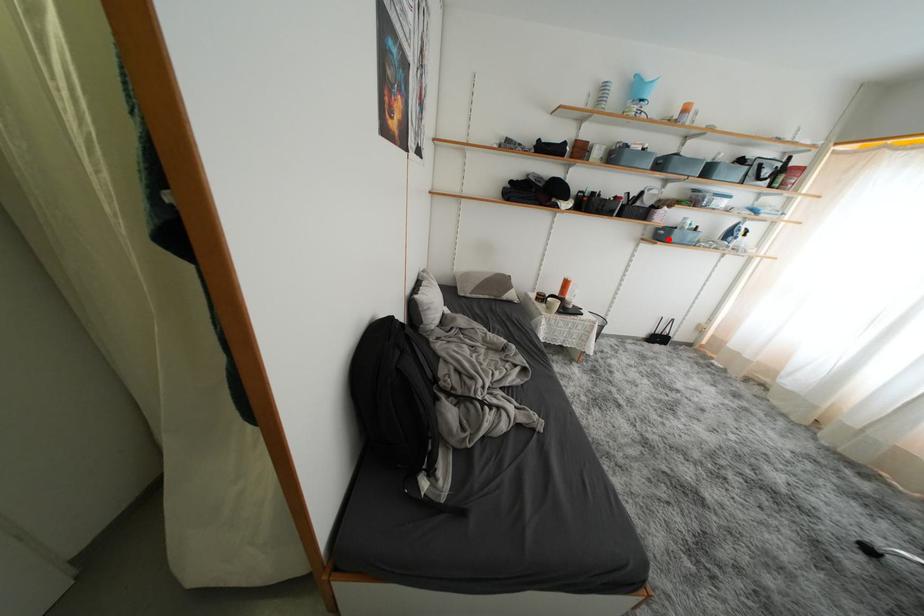
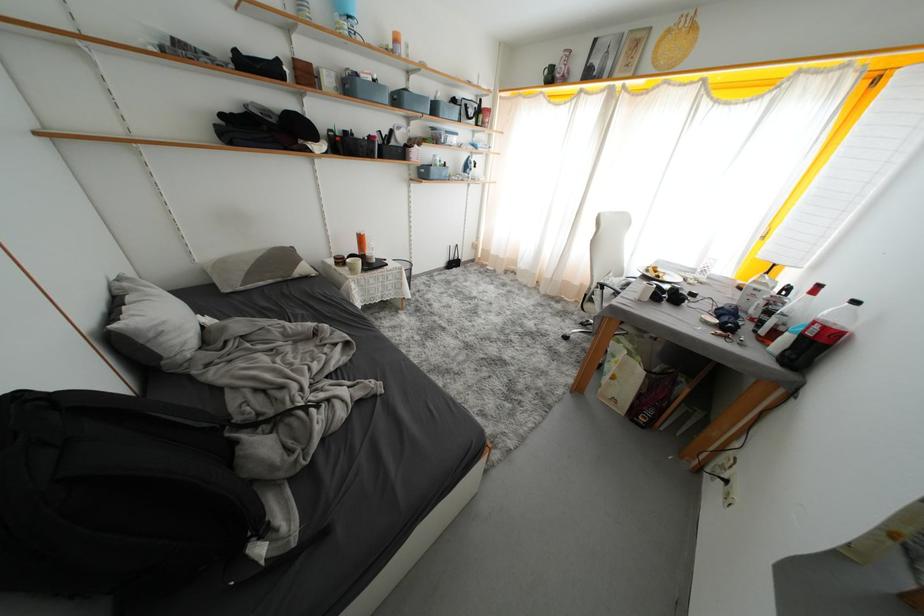
Where in the second image is the point corresponding to the highlighted location from the first image?

(431, 177)